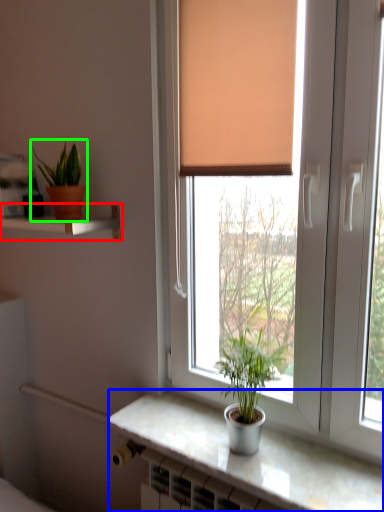
Question: Which is nearer to the shelf (highlighted by a red box)? counter top (highlighted by a blue box) or houseplant (highlighted by a green box).

Choices:
 (A) counter top
 (B) houseplant

Answer: (B)